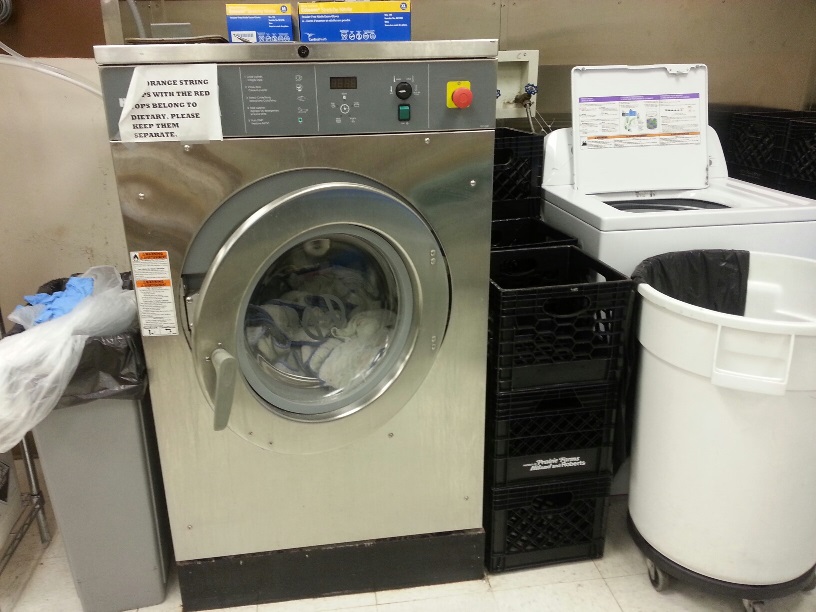
Image resolution: width=816 pixels, height=612 pixels. In order to click on floor tile in this screenshot , I will do `click(500, 601)`.